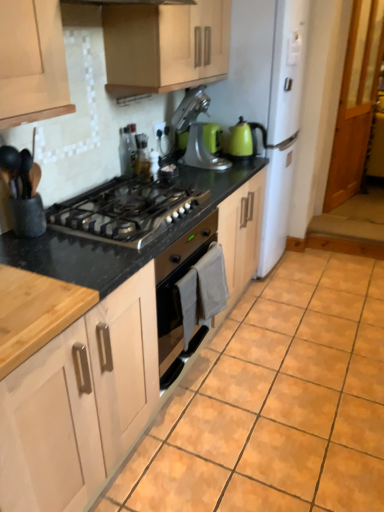
Locate an element on the screen. The image size is (384, 512). space that is in front of metallic silver stand mixer at upper center is located at coordinates (216, 176).